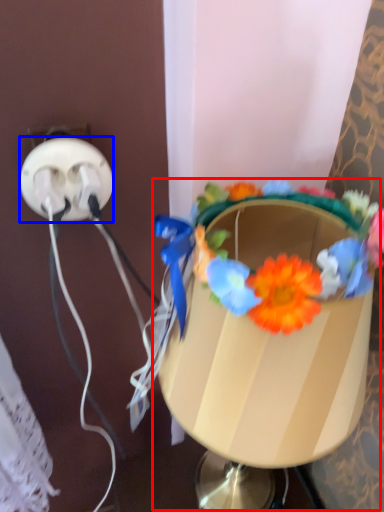
Question: Among these objects, which one is farthest to the camera, table lamp (highlighted by a red box) or power plugs and sockets (highlighted by a blue box)?

Choices:
 (A) table lamp
 (B) power plugs and sockets

Answer: (B)